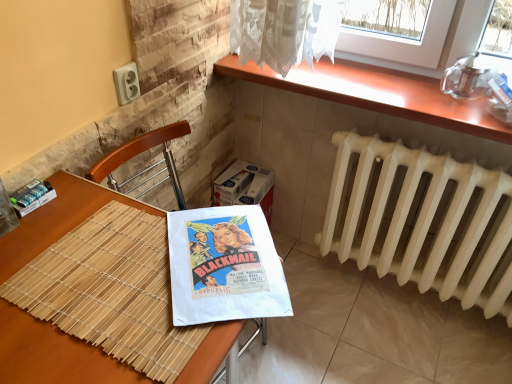
Question: Is white cardboard box at center placed right next to wooden at upper right?

Choices:
 (A) yes
 (B) no

Answer: (B)

Question: Is white cardboard box at center surrounding wooden at upper right?

Choices:
 (A) yes
 (B) no

Answer: (B)

Question: Does white cardboard box at center come behind wooden at upper right?

Choices:
 (A) yes
 (B) no

Answer: (A)

Question: Does white cardboard box at center lie in front of wooden at upper right?

Choices:
 (A) no
 (B) yes

Answer: (A)

Question: From a real-world perspective, is white cardboard box at center beneath wooden at upper right?

Choices:
 (A) no
 (B) yes

Answer: (B)

Question: From the image's perspective, is wooden table at lower left above or below wooden at upper right?

Choices:
 (A) above
 (B) below

Answer: (B)

Question: Does point (44, 365) appear closer or farther from the camera than point (422, 84)?

Choices:
 (A) farther
 (B) closer

Answer: (B)

Question: Is wooden table at lower left inside or outside of wooden at upper right?

Choices:
 (A) outside
 (B) inside

Answer: (A)

Question: Relative to wooden at upper right, is wooden table at lower left in front or behind?

Choices:
 (A) behind
 (B) front

Answer: (B)

Question: Is white matte radiator at right bigger or smaller than wooden at upper right?

Choices:
 (A) small
 (B) big

Answer: (B)

Question: From a real-world perspective, is white matte radiator at right physically located above or below wooden at upper right?

Choices:
 (A) below
 (B) above

Answer: (A)

Question: Is white matte radiator at right spatially inside wooden at upper right, or outside of it?

Choices:
 (A) outside
 (B) inside

Answer: (A)

Question: In terms of width, does white matte radiator at right look wider or thinner when compared to wooden at upper right?

Choices:
 (A) thin
 (B) wide

Answer: (A)

Question: From a real-world perspective, relative to white cardboard box at center, is wooden table at lower left vertically above or below?

Choices:
 (A) above
 (B) below

Answer: (A)

Question: Considering the positions of wooden table at lower left and white cardboard box at center in the image, is wooden table at lower left taller or shorter than white cardboard box at center?

Choices:
 (A) short
 (B) tall

Answer: (B)